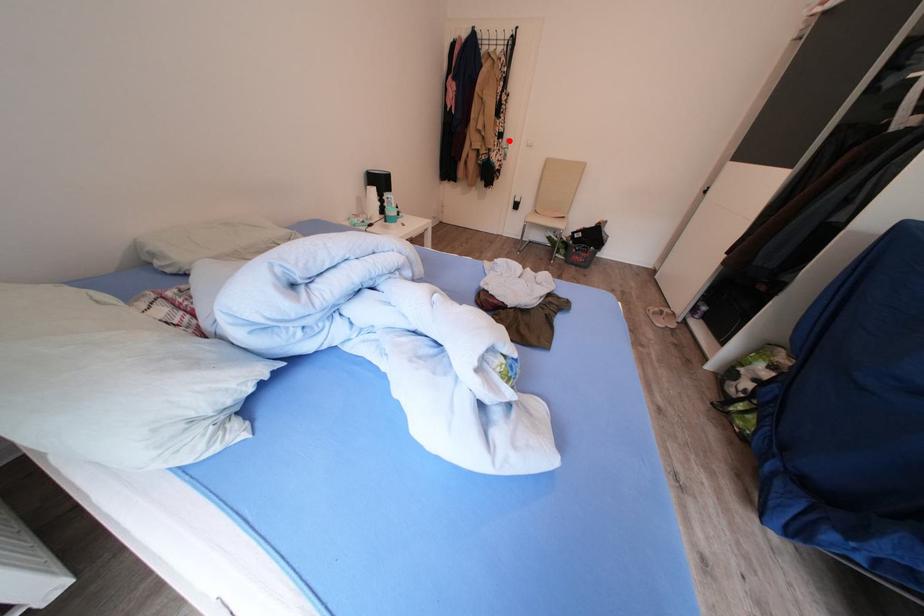
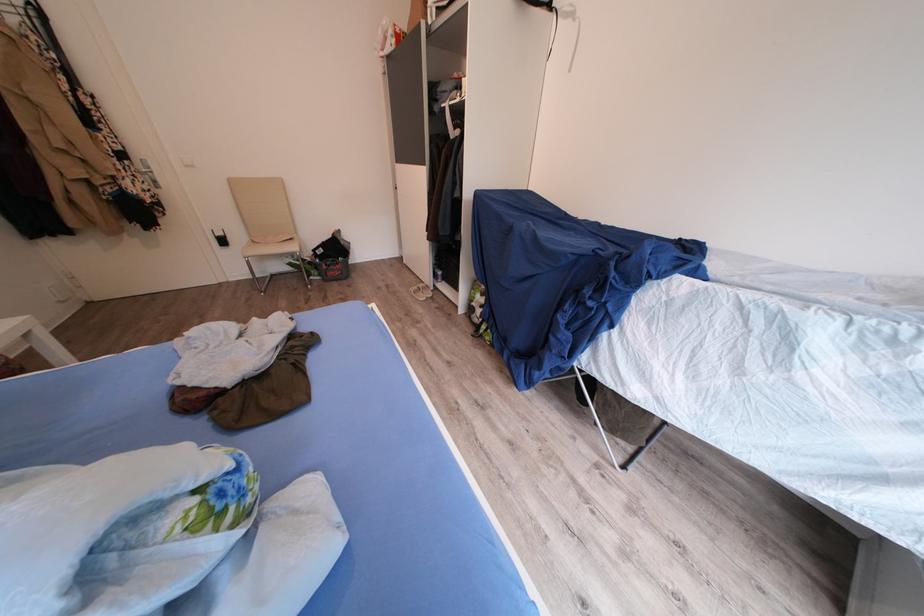
Question: I am providing you with two images of the same scene from different viewpoints. A red point is shown in image1. For the corresponding object point in image2, is it positioned nearer or farther from the camera?

Choices:
 (A) Nearer
 (B) Farther

Answer: (B)